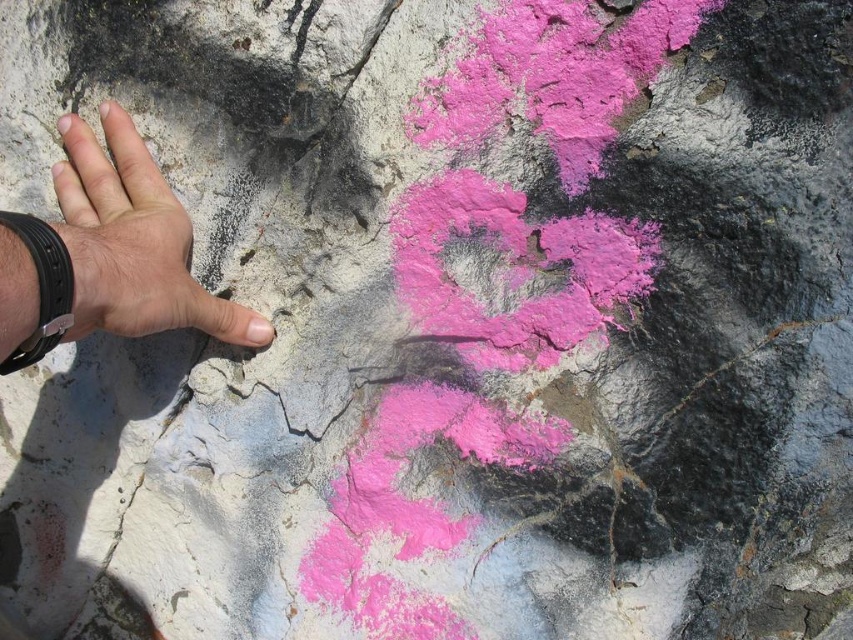
Is skinny white hand at left positioned behind cracked stone at center?

No, it is in front of cracked stone at center.

The height and width of the screenshot is (640, 853). Identify the location of skinny white hand at left. (132, 241).

The height and width of the screenshot is (640, 853). In order to click on skinny white hand at left in this screenshot , I will do `click(132, 241)`.